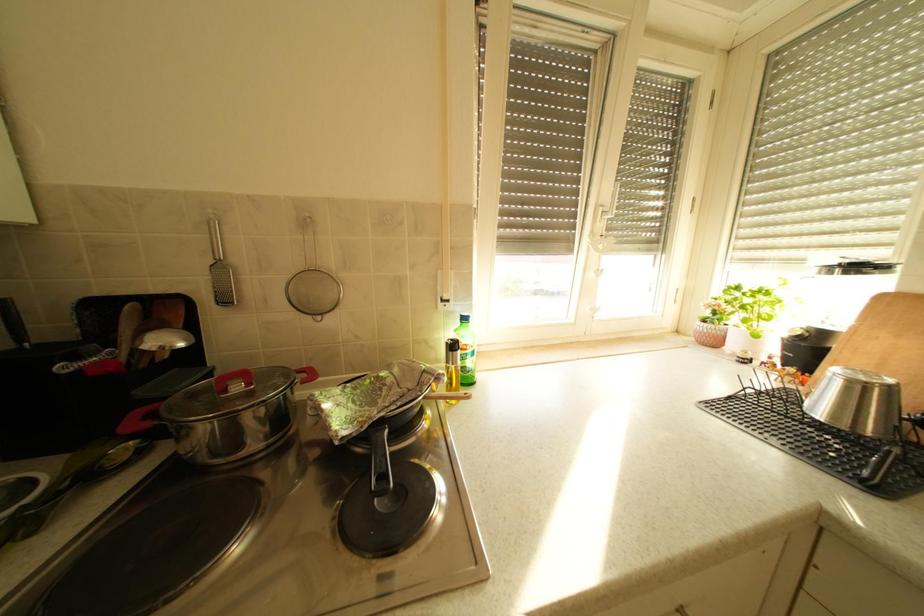
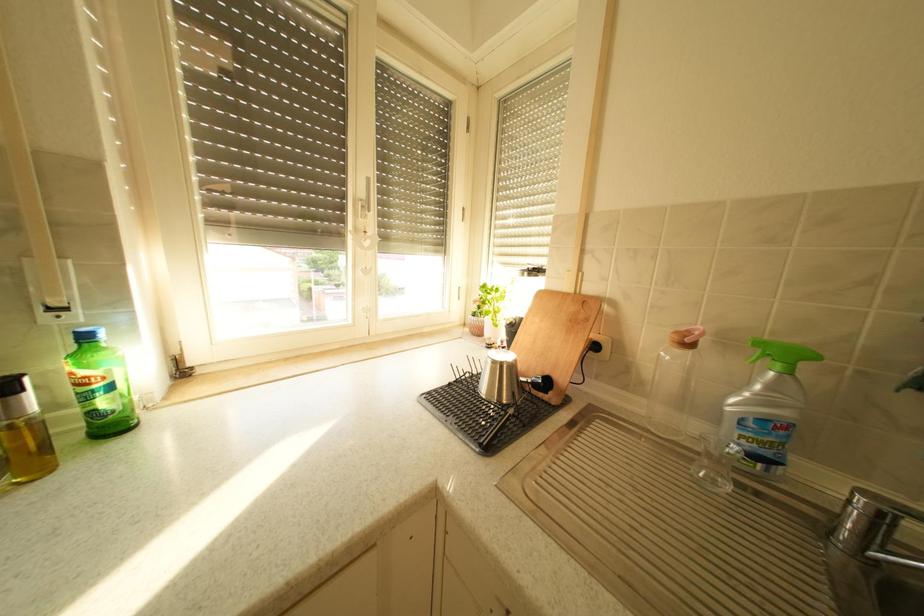
Question: The camera is either moving clockwise (left) or counter-clockwise (right) around the object. The first image is from the beginning of the video and the second image is from the end. Is the camera moving left or right when shooting the video?

Choices:
 (A) Left
 (B) Right

Answer: (A)